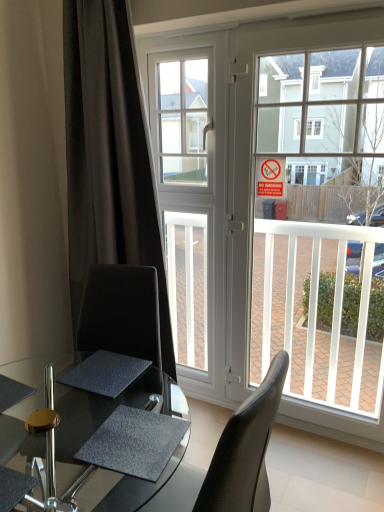
Find the location of a particular element. vacant region above clear glass door at center (from a real-world perspective) is located at coordinates (318, 22).